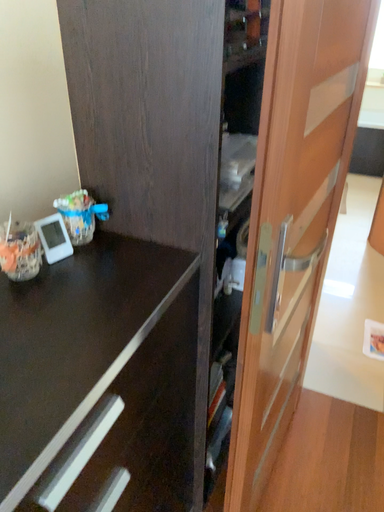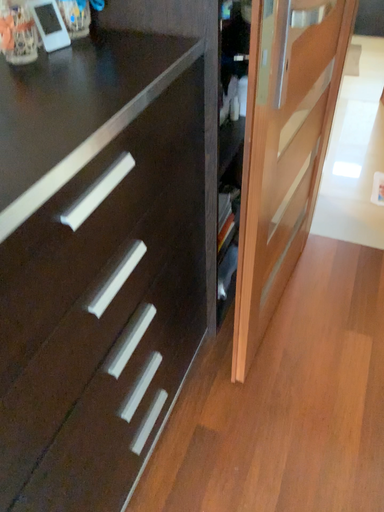
Question: How did the camera likely rotate when shooting the video?

Choices:
 (A) rotated downward
 (B) rotated upward

Answer: (A)